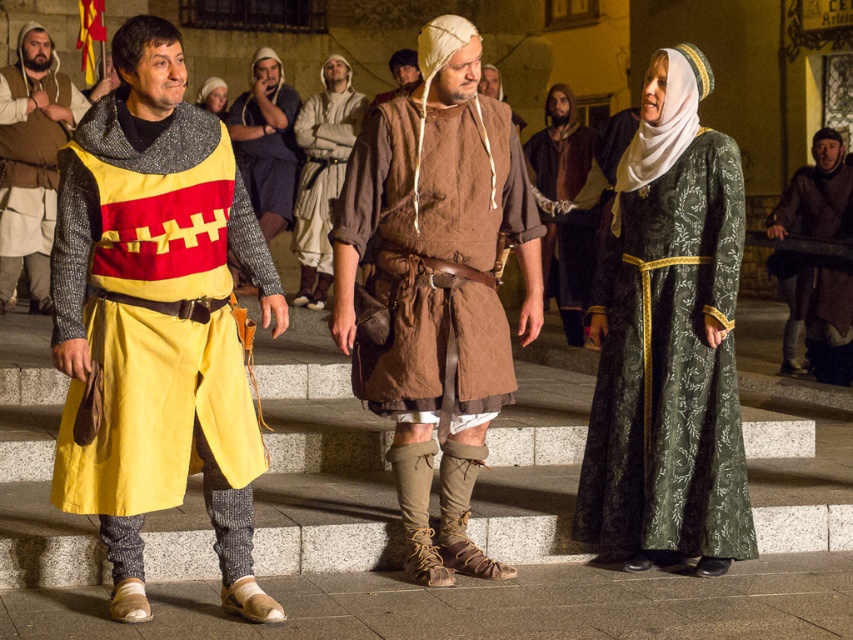
Question: Observing the image, what is the correct spatial positioning of brown leather armor at center in reference to brown leather belt at center?

Choices:
 (A) below
 (B) above

Answer: (A)

Question: Does brown leather belt at center appear over light brown leather tunic at center?

Choices:
 (A) yes
 (B) no

Answer: (B)

Question: Which point is closer to the camera?

Choices:
 (A) brown leather hat at center
 (B) light brown leather tunic at center
 (C) brown leather belt at center
 (D) brown leather tunic at center

Answer: (B)

Question: Which of these objects is positioned farthest from the brown leather hat at center?

Choices:
 (A) green brocade dress at center
 (B) brown leather vest at center

Answer: (A)

Question: Which point is farther to the camera?

Choices:
 (A) brown leather hat at center
 (B) light brown leather tunic at center
 (C) matte yellow tunic at left
 (D) green brocade dress at center

Answer: (A)

Question: Does green brocade dress at center appear over brown leather vest at center?

Choices:
 (A) yes
 (B) no

Answer: (B)